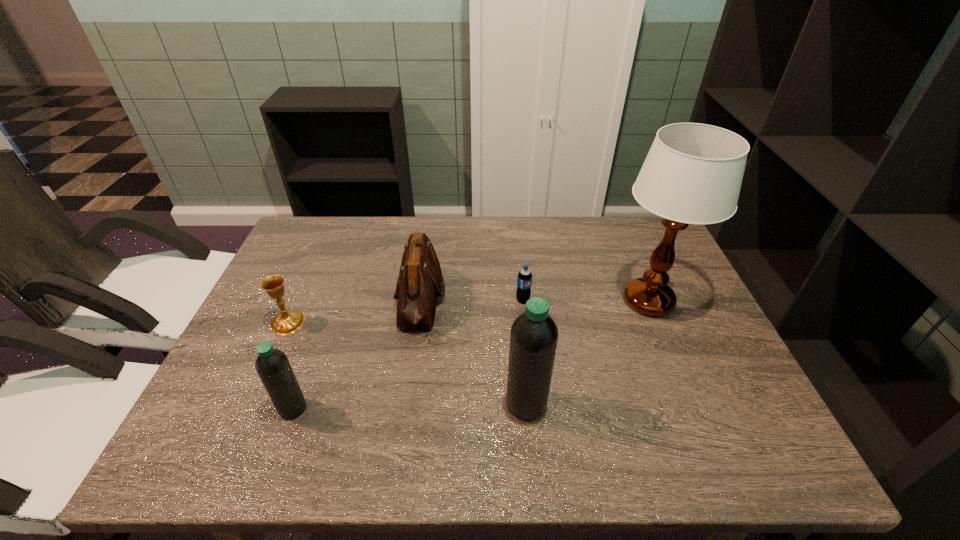
Find the location of a particular element. Image resolution: width=960 pixels, height=540 pixels. the fifth object from right to left is located at coordinates (272, 365).

At what (x,y) coordinates should I click in order to perform the action: click on the shorter water bottle. Please return your answer as a coordinate pair (x, y). This screenshot has height=540, width=960. Looking at the image, I should click on (272, 365).

Where is `the right water bottle`? The image size is (960, 540). the right water bottle is located at coordinates (534, 335).

Locate an element on the screen. The height and width of the screenshot is (540, 960). the second tallest object is located at coordinates (534, 335).

The height and width of the screenshot is (540, 960). In order to click on the leftmost object in this screenshot , I will do `click(288, 322)`.

Identify the location of the shortest object. (524, 281).

Where is `the rightmost object`? The height and width of the screenshot is (540, 960). the rightmost object is located at coordinates (693, 172).

The height and width of the screenshot is (540, 960). I want to click on table lamp, so click(693, 172).

Where is `shoulder bag`? This screenshot has width=960, height=540. shoulder bag is located at coordinates (420, 281).

Find the location of a particular element. blank space located on the right of the shorter water bottle is located at coordinates 479,408.